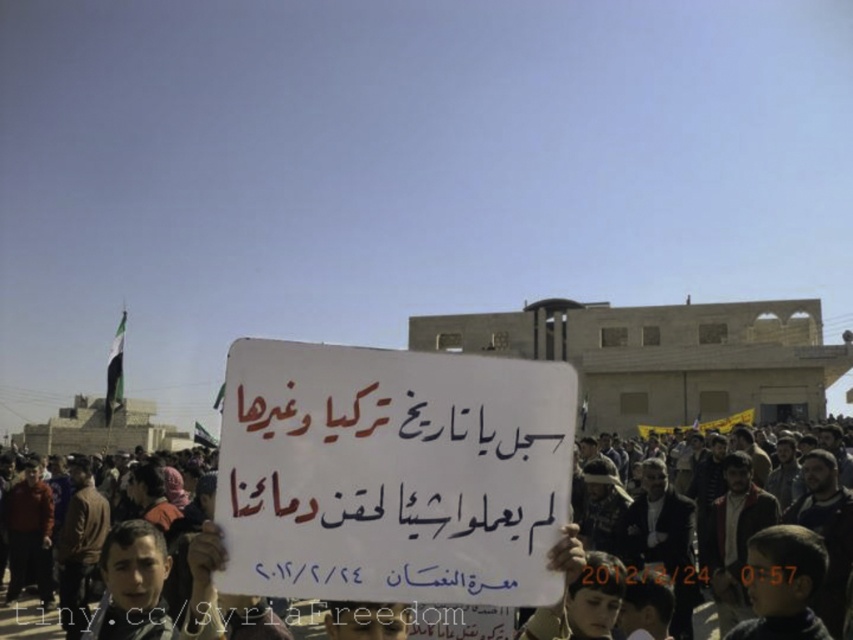
Between point (379, 419) and point (750, 456), which one is positioned in front?

Positioned in front is point (379, 419).

Which is behind, point (352, 483) or point (683, 474)?

Point (683, 474)

Locate an element on the screen. This screenshot has height=640, width=853. white paper sign at center is located at coordinates (392, 474).